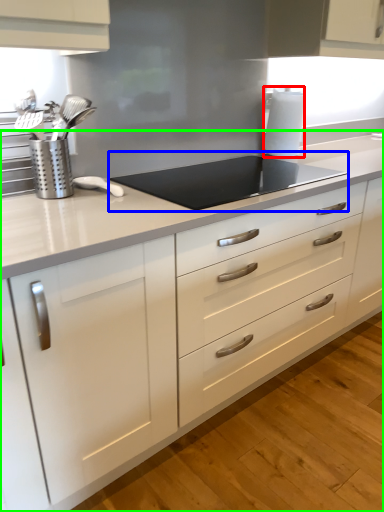
Question: Based on their relative distances, which object is farther from paper towel (highlighted by a red box)? Choose from gas stove (highlighted by a blue box) and countertop (highlighted by a green box).

Choices:
 (A) gas stove
 (B) countertop

Answer: (B)